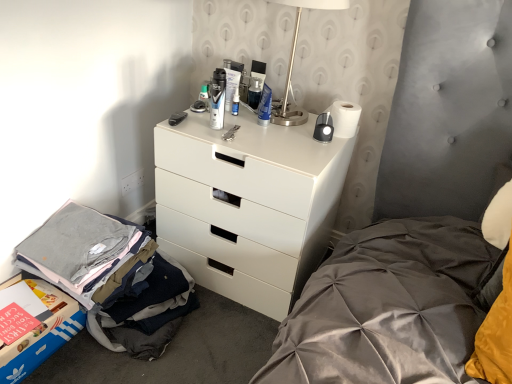
Question: From the image's perspective, is translucent plastic bottle at upper center, the 1th toiletry from the left, located above white plastic outlet at lower left?

Choices:
 (A) no
 (B) yes

Answer: (B)

Question: Is translucent plastic bottle at upper center, the 1th toiletry from the left, facing away from white plastic outlet at lower left?

Choices:
 (A) yes
 (B) no

Answer: (B)

Question: Is translucent plastic bottle at upper center, marked as the fifth toiletry in a right-to-left arrangement, shorter than white plastic outlet at lower left?

Choices:
 (A) no
 (B) yes

Answer: (B)

Question: Is translucent plastic bottle at upper center, the 1th toiletry from the left, placed right next to white plastic outlet at lower left?

Choices:
 (A) yes
 (B) no

Answer: (B)

Question: Considering the relative positions of translucent plastic bottle at upper center, the 1th toiletry from the left, and white plastic outlet at lower left in the image provided, is translucent plastic bottle at upper center, the 1th toiletry from the left, in front of white plastic outlet at lower left?

Choices:
 (A) yes
 (B) no

Answer: (A)

Question: Would you say blue glossy bottle at center, the second toiletry viewed from the right, is inside or outside blue plastic tube at center, which is the 1th toiletry from right to left?

Choices:
 (A) inside
 (B) outside

Answer: (B)

Question: Considering the positions of blue glossy bottle at center, the fourth toiletry positioned from the left, and blue plastic tube at center, positioned as the 5th toiletry in left-to-right order, in the image, is blue glossy bottle at center, the fourth toiletry positioned from the left, bigger or smaller than blue plastic tube at center, positioned as the 5th toiletry in left-to-right order,?

Choices:
 (A) big
 (B) small

Answer: (B)

Question: From the image's perspective, relative to blue plastic tube at center, which is the 1th toiletry from right to left, is blue glossy bottle at center, the second toiletry viewed from the right, above or below?

Choices:
 (A) below
 (B) above

Answer: (B)

Question: Considering the positions of point (232, 105) and point (268, 114), is point (232, 105) closer or farther from the camera than point (268, 114)?

Choices:
 (A) closer
 (B) farther

Answer: (B)

Question: Is translucent plastic bottle at upper center, marked as the fifth toiletry in a right-to-left arrangement, in front of or behind satin silver table lamp at upper right in the image?

Choices:
 (A) behind
 (B) front

Answer: (A)

Question: From a real-world perspective, is translucent plastic bottle at upper center, marked as the fifth toiletry in a right-to-left arrangement, positioned above or below satin silver table lamp at upper right?

Choices:
 (A) below
 (B) above

Answer: (A)

Question: In the image, is translucent plastic bottle at upper center, the 1th toiletry from the left, on the left side or the right side of satin silver table lamp at upper right?

Choices:
 (A) right
 (B) left

Answer: (B)

Question: In terms of size, does translucent plastic bottle at upper center, the 1th toiletry from the left, appear bigger or smaller than satin silver table lamp at upper right?

Choices:
 (A) small
 (B) big

Answer: (A)

Question: Is matte plastic tube at upper center, which ranks as the third toiletry in left-to-right order, spatially inside white matte chest of drawers at center, or outside of it?

Choices:
 (A) inside
 (B) outside

Answer: (B)

Question: Considering the relative positions of matte plastic tube at upper center, which ranks as the third toiletry in left-to-right order, and white matte chest of drawers at center in the image provided, is matte plastic tube at upper center, which ranks as the third toiletry in left-to-right order, to the left or to the right of white matte chest of drawers at center?

Choices:
 (A) left
 (B) right

Answer: (A)